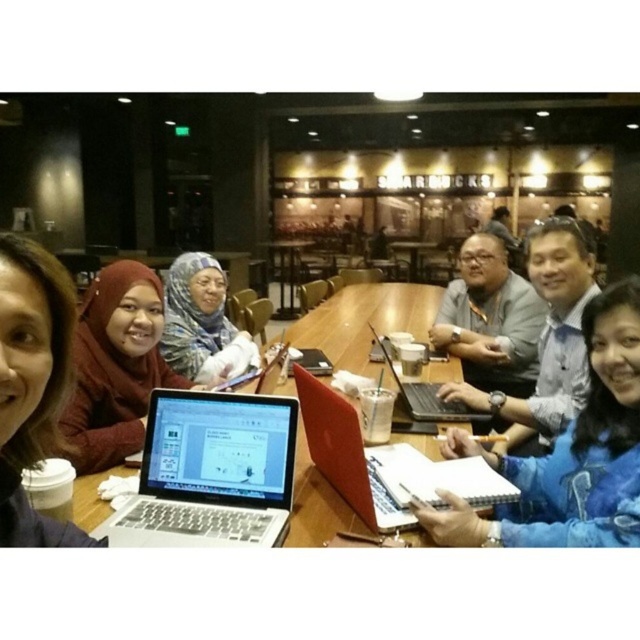
You are a customer sitting at the Starbucks table. You need to place your phone on the table such that it is as close as possible to the silver metallic laptop at center without overlapping it. Where should you place your phone?

Place your phone near the silver metallic laptop at center but not overlapping it. The exact coordinates would depend on the table layout, but positioning it close to the laptop while maintaining a slight distance ensures accessibility and avoids obstruction.

You are a barista at the Starbucks in the image. You need to place a new coffee cup on the table without moving any existing items. The blue denim jacket at lower right and the red matte laptop at center are in the way. Which item should you move to make space?

The blue denim jacket at lower right is wider than the red matte laptop at center, so moving the jacket would create more space for the coffee cup.

You are taking a photo of the scene and want to focus on both point [560,470] and point [308,428]. Which point should you adjust your camera focus to first to ensure both are in focus?

Point [560,470] is closer to the camera than point [308,428]. To ensure both are in focus, you should first focus on point [560,470] since it is closer, and then adjust the focus range to include point [308,428] which is farther away.